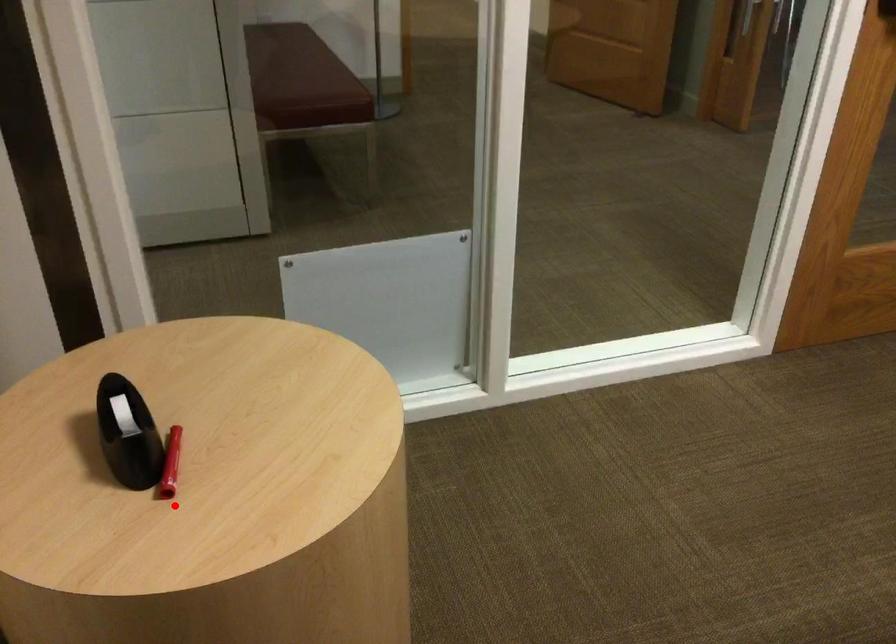
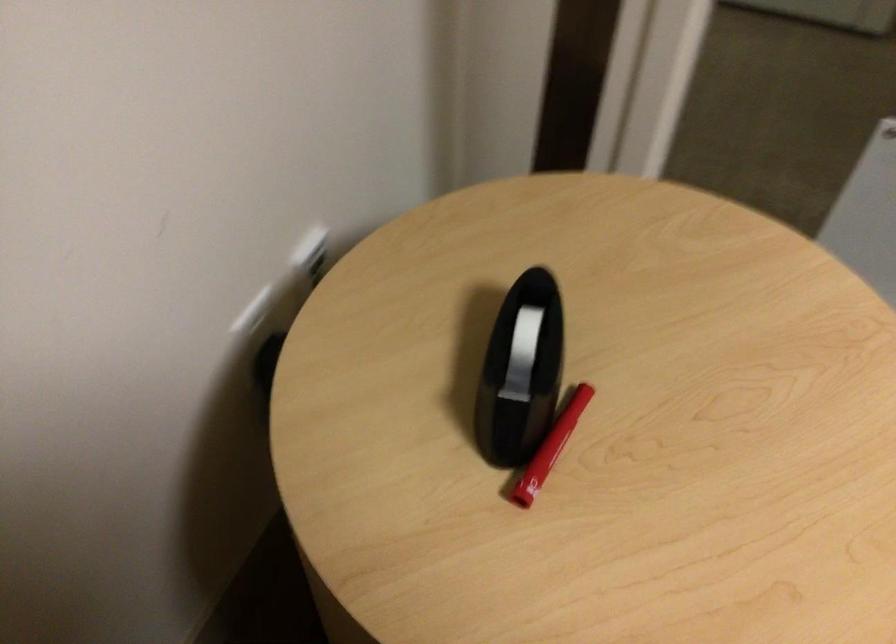
Question: A red point is marked in image1. In image2, is the corresponding 3D point closer to the camera or farther? Reply with the corresponding letter.

Choices:
 (A) The corresponding 3D point is closer.
 (B) The corresponding 3D point is farther.

Answer: (A)